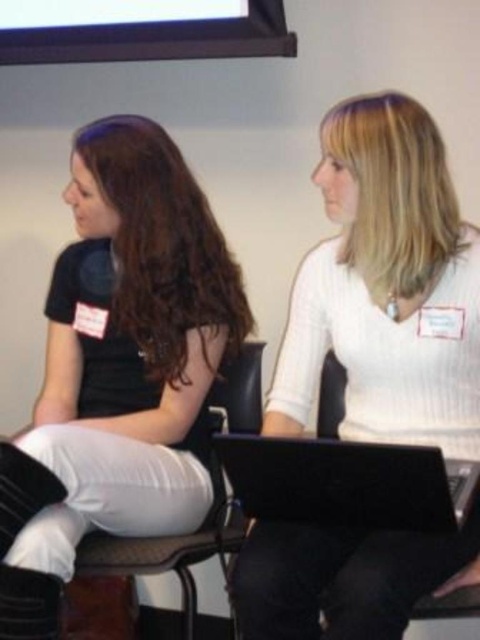
Question: Does white ribbed sweater at center have a greater width compared to black plastic chair at lower center?

Choices:
 (A) no
 (B) yes

Answer: (B)

Question: Considering the real-world distances, which object is closest to the matte black shirt at left?

Choices:
 (A) black leather chair at center
 (B) white ribbed sweater at center
 (C) black matte laptop at center
 (D) black plastic chair at lower center

Answer: (A)

Question: Is matte black shirt at left thinner than black plastic chair at lower center?

Choices:
 (A) no
 (B) yes

Answer: (A)

Question: Among these points, which one is farthest from the camera?

Choices:
 (A) (324, 502)
 (B) (360, 236)
 (C) (324, 385)

Answer: (C)

Question: Which point is farther to the camera?

Choices:
 (A) white ribbed sweater at center
 (B) black plastic chair at lower center

Answer: (B)

Question: Is black matte laptop at center closer to camera compared to black plastic chair at lower center?

Choices:
 (A) yes
 (B) no

Answer: (A)